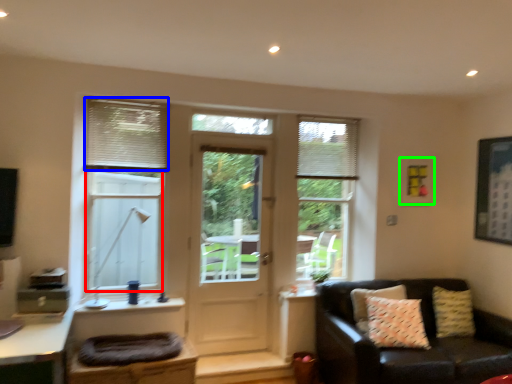
Question: Which is nearer to the bay window (highlighted by a red box)? shutter (highlighted by a blue box) or picture frame (highlighted by a green box).

Choices:
 (A) shutter
 (B) picture frame

Answer: (A)